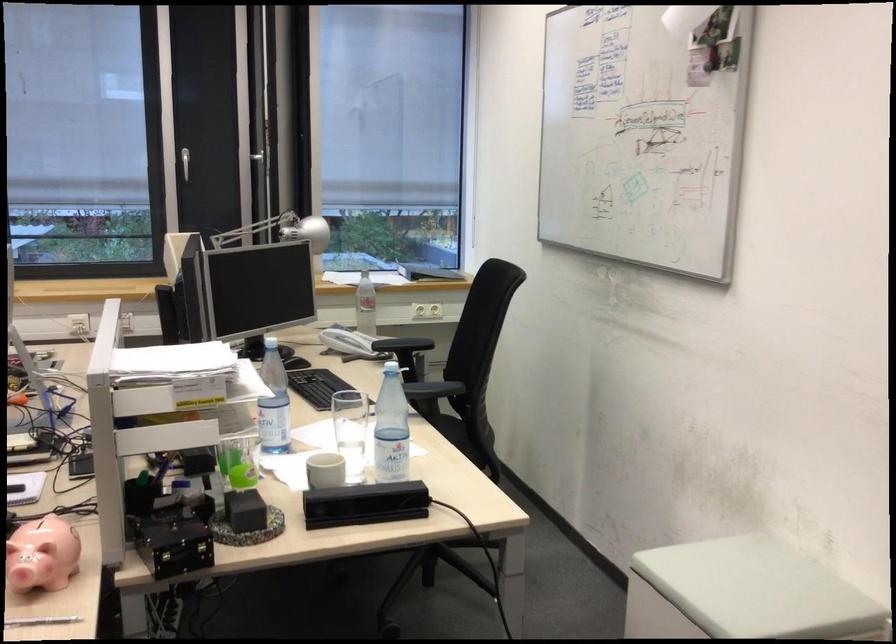
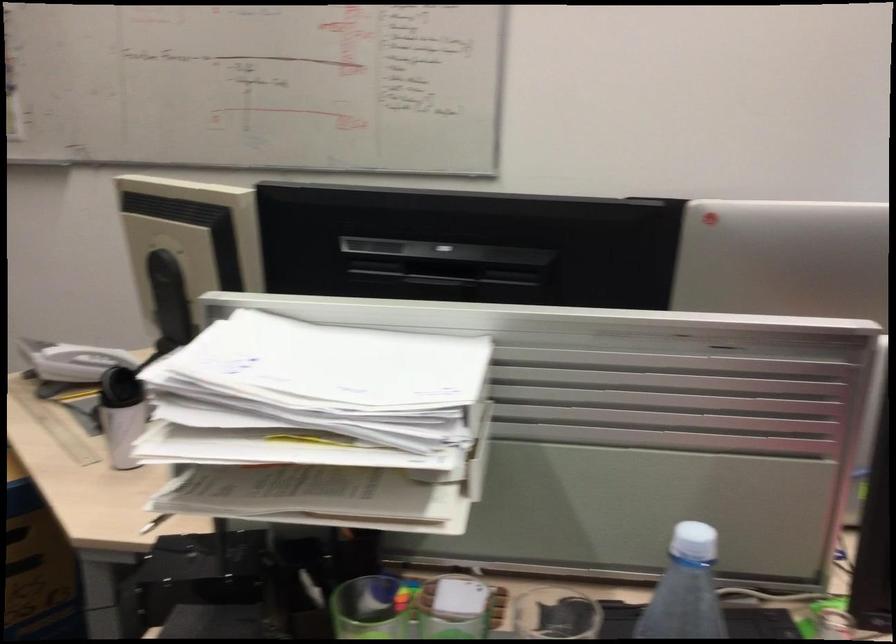
In the second image, find the point that corresponds to pixel 185 500 in the first image.

(367, 609)